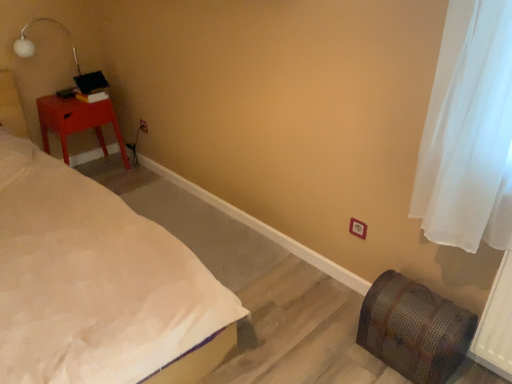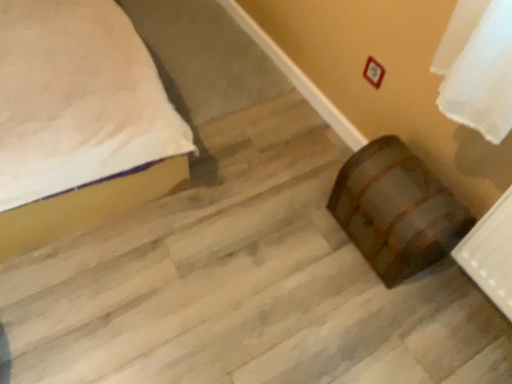
Question: How did the camera likely rotate when shooting the video?

Choices:
 (A) rotated left
 (B) rotated right

Answer: (A)